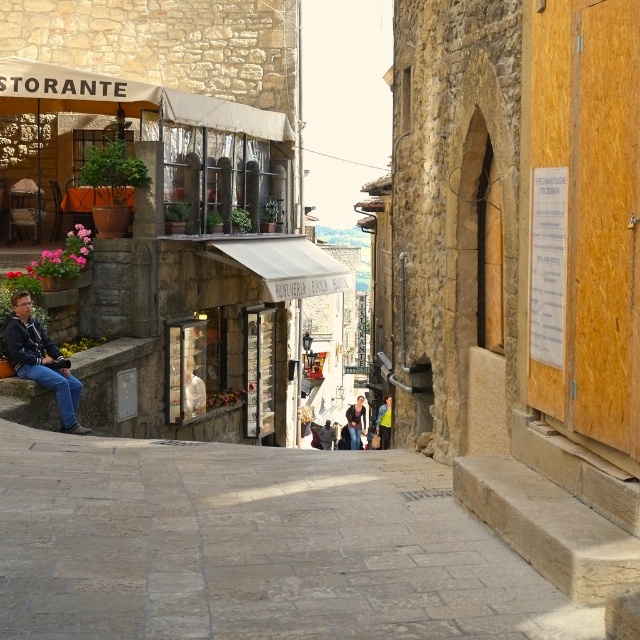
Image resolution: width=640 pixels, height=640 pixels. What do you see at coordinates (355, 422) in the screenshot? I see `denim jacket at center` at bounding box center [355, 422].

Who is positioned more to the right, denim jacket at center or yellow-green shirt at center?

yellow-green shirt at center

Who is more distant from viewer, (362, 396) or (384, 412)?

Point (362, 396)

Locate an element on the screen. Image resolution: width=640 pixels, height=640 pixels. denim jacket at center is located at coordinates (355, 422).

Looking at this image, is yellow-green shirt at center below dark blue jeans at center?

Actually, yellow-green shirt at center is above dark blue jeans at center.

Who is lower down, yellow-green shirt at center or dark blue jeans at center?

dark blue jeans at center is below.

Describe the element at coordinates (385, 422) in the screenshot. I see `yellow-green shirt at center` at that location.

This screenshot has height=640, width=640. I want to click on yellow-green shirt at center, so click(x=385, y=422).

Does point (220, 552) come farther from viewer compared to point (388, 433)?

No, it is not.

Locate an element on the screen. This screenshot has width=640, height=640. gray stone alley at center is located at coordinates (252, 547).